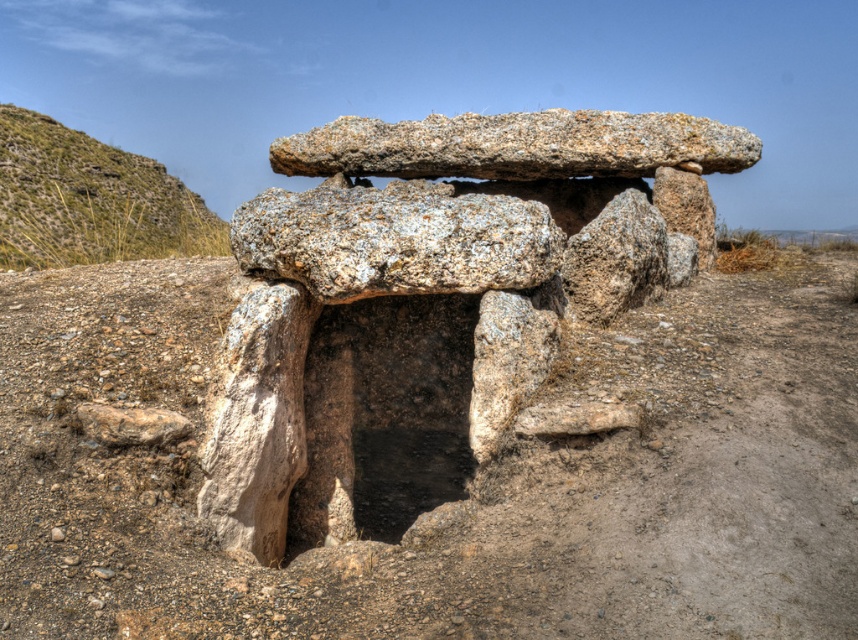
Is granite rock formation at center positioned in front of green grassy hill at upper left?

Yes, granite rock formation at center is closer to the viewer.

Which of these two, granite rock formation at center or green grassy hill at upper left, stands taller?

granite rock formation at center is taller.

Describe the element at coordinates (433, 291) in the screenshot. I see `granite rock formation at center` at that location.

The image size is (858, 640). Identify the location of granite rock formation at center. (433, 291).